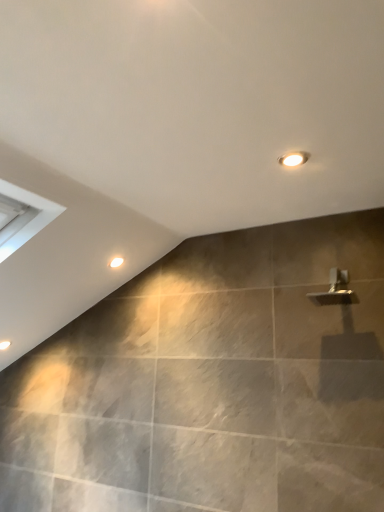
Question: Should I look upward or downward to see matte white light fixture at upper center?

Choices:
 (A) down
 (B) up

Answer: (B)

Question: Is matte white light fixture at upper center located within white glossy droplight at upper center?

Choices:
 (A) yes
 (B) no

Answer: (B)

Question: Is white glossy droplight at upper center not near matte white light fixture at upper center?

Choices:
 (A) yes
 (B) no

Answer: (A)

Question: Is the depth of white glossy droplight at upper center greater than that of matte white light fixture at upper center?

Choices:
 (A) yes
 (B) no

Answer: (A)

Question: Does white glossy droplight at upper center appear on the left side of matte white light fixture at upper center?

Choices:
 (A) no
 (B) yes

Answer: (B)

Question: Considering the relative sizes of white glossy droplight at upper center and matte white light fixture at upper center in the image provided, is white glossy droplight at upper center shorter than matte white light fixture at upper center?

Choices:
 (A) no
 (B) yes

Answer: (A)

Question: Is white glossy droplight at upper center not inside matte white light fixture at upper center?

Choices:
 (A) no
 (B) yes

Answer: (B)

Question: Can you confirm if matte white light fixture at upper center is wider than white glossy droplight at upper center?

Choices:
 (A) yes
 (B) no

Answer: (A)

Question: Considering the relative sizes of matte white light fixture at upper center and white glossy droplight at upper center in the image provided, is matte white light fixture at upper center taller than white glossy droplight at upper center?

Choices:
 (A) no
 (B) yes

Answer: (A)

Question: From the image's perspective, is matte white light fixture at upper center located beneath white glossy droplight at upper center?

Choices:
 (A) no
 (B) yes

Answer: (A)

Question: Would you say matte white light fixture at upper center is a long distance from white glossy droplight at upper center?

Choices:
 (A) yes
 (B) no

Answer: (A)

Question: From a real-world perspective, is matte white light fixture at upper center located beneath white glossy droplight at upper center?

Choices:
 (A) no
 (B) yes

Answer: (A)

Question: Would you say matte white light fixture at upper center is outside white glossy droplight at upper center?

Choices:
 (A) no
 (B) yes

Answer: (B)

Question: From a real-world perspective, is white glossy droplight at upper center above or below matte white light fixture at upper center?

Choices:
 (A) below
 (B) above

Answer: (A)